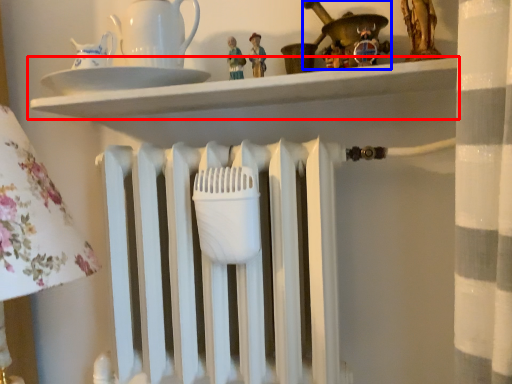
Question: Among these objects, which one is farthest to the camera, shelf (highlighted by a red box) or toy (highlighted by a blue box)?

Choices:
 (A) shelf
 (B) toy

Answer: (B)